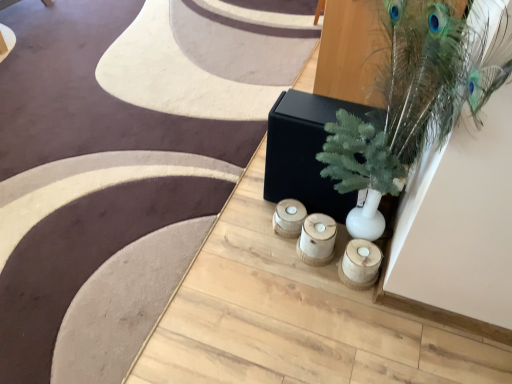
Question: Could wooden candle holder at lower center, acting as the 1th candle holder starting from the right, be considered to be inside white matte vase at upper right?

Choices:
 (A) no
 (B) yes

Answer: (B)

Question: From a real-world perspective, is white matte vase at upper right below wooden candle holder at lower center, acting as the 1th candle holder starting from the right?

Choices:
 (A) yes
 (B) no

Answer: (B)

Question: Does white matte vase at upper right have a smaller size compared to wooden candle holder at lower center, positioned as the second candle holder in left-to-right order?

Choices:
 (A) yes
 (B) no

Answer: (B)

Question: Considering the relative sizes of white matte vase at upper right and wooden candle holder at lower center, acting as the 1th candle holder starting from the right, in the image provided, is white matte vase at upper right taller than wooden candle holder at lower center, acting as the 1th candle holder starting from the right,?

Choices:
 (A) yes
 (B) no

Answer: (A)

Question: Is white matte vase at upper right beside wooden candle holder at lower center, acting as the 1th candle holder starting from the right?

Choices:
 (A) yes
 (B) no

Answer: (B)

Question: Considering the relative positions of wooden candle holders at center, the first candle holder positioned from the left, and wooden candle holder at lower center, acting as the 1th candle holder starting from the right, in the image provided, is wooden candle holders at center, the first candle holder positioned from the left, to the left or to the right of wooden candle holder at lower center, acting as the 1th candle holder starting from the right,?

Choices:
 (A) right
 (B) left

Answer: (B)

Question: Is wooden candle holders at center, the first candle holder positioned from the left, wider or thinner than wooden candle holder at lower center, acting as the 1th candle holder starting from the right?

Choices:
 (A) wide
 (B) thin

Answer: (A)

Question: From the image's perspective, is wooden candle holders at center, the first candle holder positioned from the left, above or below wooden candle holder at lower center, positioned as the second candle holder in left-to-right order?

Choices:
 (A) below
 (B) above

Answer: (B)

Question: Considering the positions of point (317, 246) and point (378, 249), is point (317, 246) closer or farther from the camera than point (378, 249)?

Choices:
 (A) closer
 (B) farther

Answer: (B)

Question: From the image's perspective, is wooden candle holder at lower center, acting as the 1th candle holder starting from the right, located above or below white matte vase at upper right?

Choices:
 (A) above
 (B) below

Answer: (B)

Question: Looking at their shapes, would you say wooden candle holder at lower center, positioned as the second candle holder in left-to-right order, is wider or thinner than white matte vase at upper right?

Choices:
 (A) thin
 (B) wide

Answer: (A)

Question: Visually, is wooden candle holder at lower center, acting as the 1th candle holder starting from the right, positioned to the left or to the right of white matte vase at upper right?

Choices:
 (A) right
 (B) left

Answer: (B)

Question: In terms of size, does wooden candle holder at lower center, acting as the 1th candle holder starting from the right, appear bigger or smaller than white matte vase at upper right?

Choices:
 (A) big
 (B) small

Answer: (B)

Question: Considering the positions of white matte vase at upper right and wooden candle holder at lower center, acting as the 1th candle holder starting from the right, in the image, is white matte vase at upper right wider or thinner than wooden candle holder at lower center, acting as the 1th candle holder starting from the right,?

Choices:
 (A) thin
 (B) wide

Answer: (B)

Question: Looking at the image, does white matte vase at upper right seem bigger or smaller compared to wooden candle holder at lower center, positioned as the second candle holder in left-to-right order?

Choices:
 (A) big
 (B) small

Answer: (A)